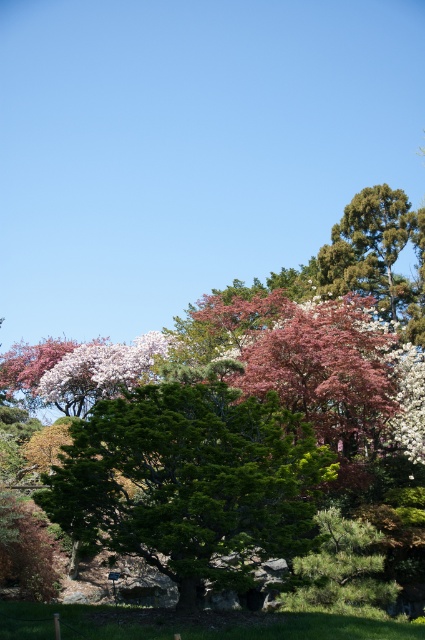
You are planning to plant a new tree in your garden. You have two options based on the image provided. The first option is the green leafy tree at center, and the second is the green textured tree at upper right. If you want a wider tree for more shade, which one should you choose?

The green textured tree at upper right has a greater width than the green leafy tree at center, so it would provide more shade due to its larger size.

You are standing in the middle of a garden and see the green leafy tree at center and the pink matte flower at center. Which one is positioned to the right side?

The green leafy tree at center is positioned to the right of the pink matte flower at center.